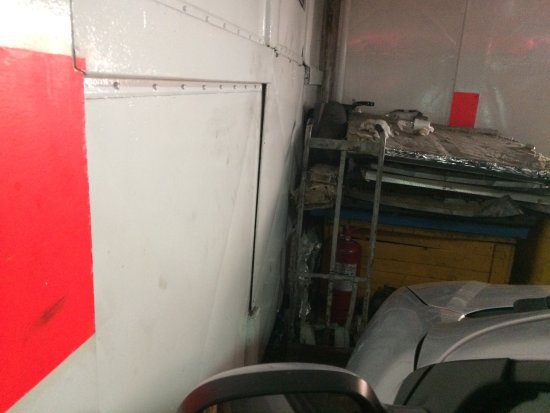
I want to click on wall, so click(192, 183).